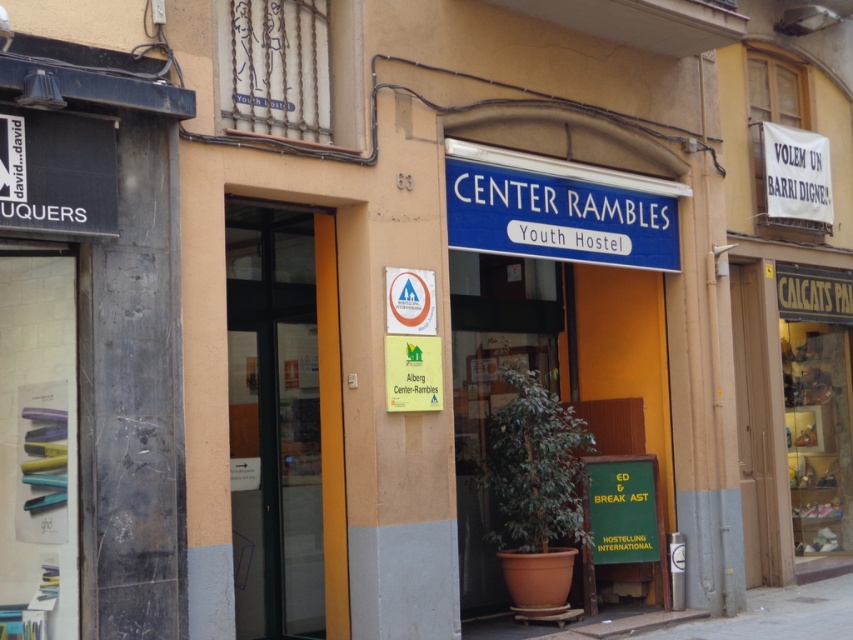
You are a visitor approaching the hostel entrance and need to read both the blue plastic sign at center and the green matte signboard at lower right. Which sign should you look up to see first?

The blue plastic sign at center is above the green matte signboard at lower right, so you should look up to see the blue plastic sign at center first before looking down to the green matte signboard at lower right.

You are a delivery person approaching the hostel entrance. You need to place a package on the ground near the transparent glass door at center. Where should you place it relative to the gray concrete pavement at lower center?

You should place the package to the left of the gray concrete pavement at lower center because the transparent glass door at center is located to the left of it.